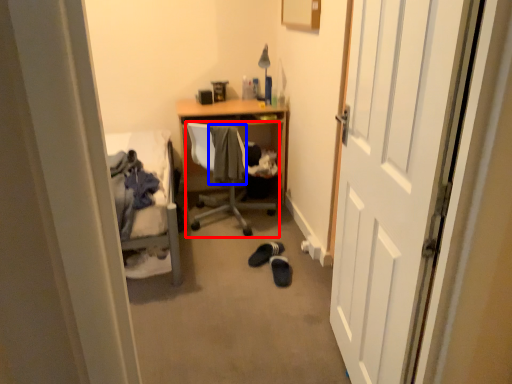
Question: Which object appears farthest to the camera in this image, chair (highlighted by a red box) or clothing (highlighted by a blue box)?

Choices:
 (A) chair
 (B) clothing

Answer: (B)